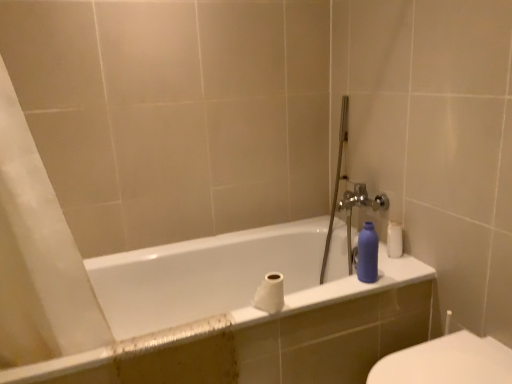
Question: Considering their positions, is white matte toilet paper at center located in front of or behind white glossy toilet at lower right?

Choices:
 (A) front
 (B) behind

Answer: (B)

Question: Is white matte toilet paper at center taller or shorter than white glossy toilet at lower right?

Choices:
 (A) short
 (B) tall

Answer: (A)

Question: Which object is positioned closest to the matte plastic bottle at right?

Choices:
 (A) white glossy bathtub at center
 (B) white glossy toilet at lower right
 (C) white matte toilet paper at center

Answer: (C)

Question: Which object is the closest to the white glossy toilet at lower right?

Choices:
 (A) white matte toilet paper at center
 (B) white glossy bathtub at center
 (C) matte plastic bottle at right

Answer: (C)